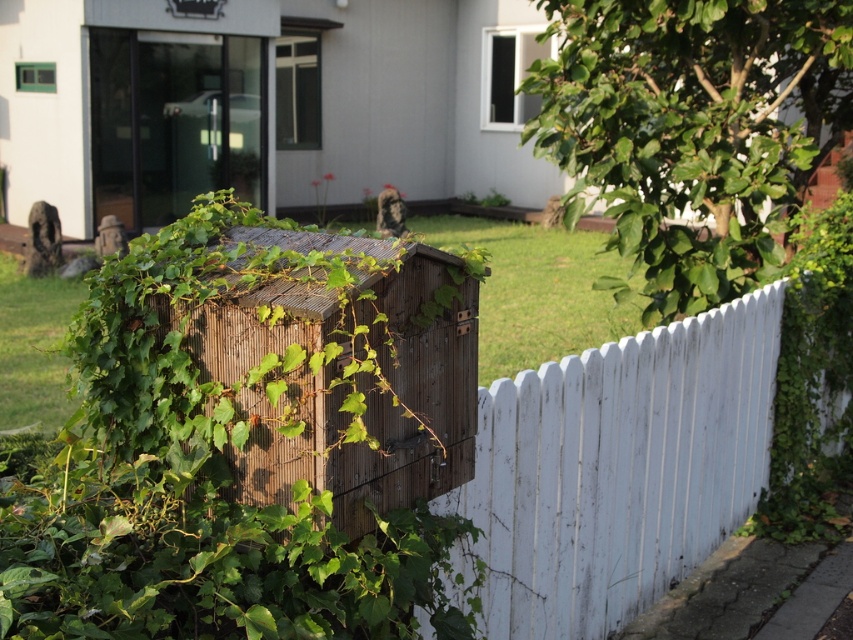
You are a gardener trying to trim the green leafy ivy at center and the white wooden fence at center. Which object is positioned higher relative to the other?

The green leafy ivy at center is above the white wooden fence at center, so it is positioned higher.

You are a gardener who wants to trim the green leafy ivy at center and the white wooden fence at center. Which object is located to the left of the other?

The green leafy ivy at center is positioned on the left side of white wooden fence at center.

You are a gardener planning to trim the green leafy ivy at center and the white wooden fence at center. Which object requires more horizontal space to maintain its current appearance?

The white wooden fence at center requires more horizontal space to maintain its current appearance because the green leafy ivy at center is narrower than the white wooden fence at center.